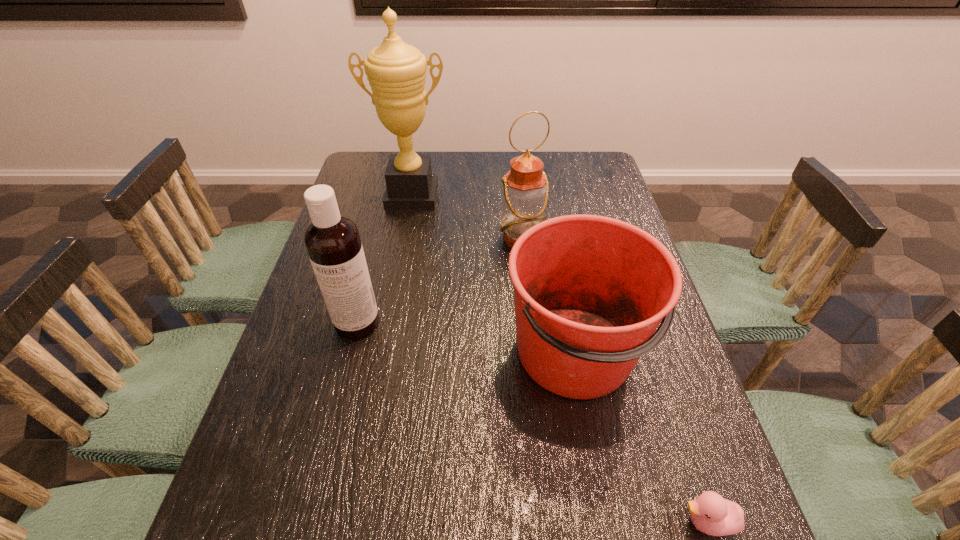
The width and height of the screenshot is (960, 540). Identify the location of trophy cup present at the left edge. (396, 71).

Image resolution: width=960 pixels, height=540 pixels. I want to click on dishwasher detergent at the left edge, so click(x=332, y=241).

Find the location of a particular element. Image resolution: width=960 pixels, height=540 pixels. object present at the right edge is located at coordinates (590, 291).

The image size is (960, 540). What are the coordinates of `object at the far left corner` in the screenshot? It's located at (396, 71).

This screenshot has width=960, height=540. In the image, there is a desktop. Identify the location of vacant space at the far edge. (466, 150).

You are a GUI agent. You are given a task and a screenshot of the screen. Output one action in this format:
    pyautogui.click(x=<x>, y=<y>)
    Task: Click on the free space at the left edge of the desktop
    The width and height of the screenshot is (960, 540).
    Given the screenshot: What is the action you would take?
    pyautogui.click(x=317, y=308)

Locate an element on the screen. Image resolution: width=960 pixels, height=540 pixels. free point at the right edge is located at coordinates (571, 212).

At what (x,y) coordinates should I click in order to perform the action: click on vacant space at the far right corner. Please return your answer as a coordinate pair (x, y). Looking at the image, I should click on (599, 164).

Where is `vacant area between the dishwasher detergent and the bucket`? vacant area between the dishwasher detergent and the bucket is located at coordinates (467, 338).

This screenshot has width=960, height=540. Identify the location of empty space between the fourth nearest object and the dishwasher detergent. (440, 281).